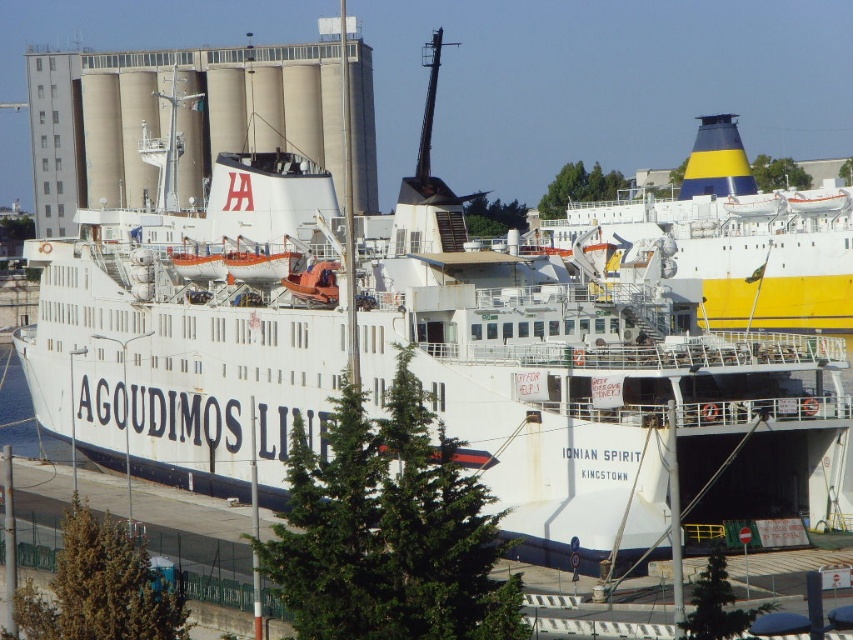
Is yellow and blue painted ship at upper right positioned before blue water at lower left?

Yes, it is.

Can you confirm if yellow and blue painted ship at upper right is positioned below blue water at lower left?

Actually, yellow and blue painted ship at upper right is above blue water at lower left.

Which is in front, point (624, 198) or point (6, 412)?

Point (6, 412)

Where is `yellow and blue painted ship at upper right`? This screenshot has height=640, width=853. yellow and blue painted ship at upper right is located at coordinates (740, 240).